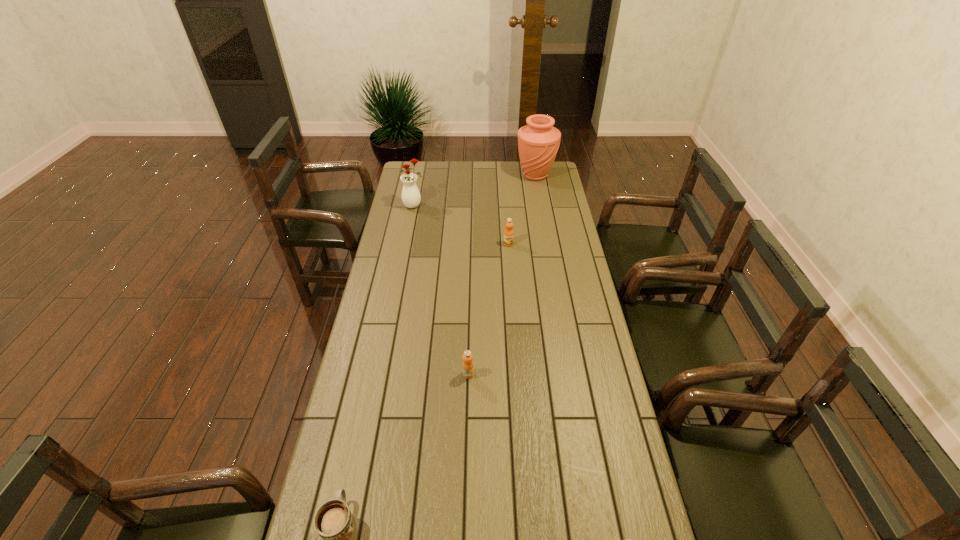
Image resolution: width=960 pixels, height=540 pixels. In order to click on free space located 0.350m on the front label of the third object from right to left in this screenshot , I will do `click(513, 305)`.

Locate an element on the screen. The width and height of the screenshot is (960, 540). free space located on the front label of the fourth farthest object is located at coordinates (468, 393).

Locate an element on the screen. This screenshot has width=960, height=540. object located in the far edge section of the desktop is located at coordinates (538, 142).

Image resolution: width=960 pixels, height=540 pixels. In order to click on object that is at the left edge in this screenshot , I will do `click(411, 197)`.

Image resolution: width=960 pixels, height=540 pixels. In order to click on object positioned at the right edge in this screenshot , I will do `click(538, 142)`.

Identify the location of object at the far right corner. Image resolution: width=960 pixels, height=540 pixels. (538, 142).

Locate an element on the screen. This screenshot has width=960, height=540. free space at the far edge is located at coordinates (523, 176).

Locate an element on the screen. The image size is (960, 540). vacant space at the left edge is located at coordinates (414, 272).

Locate an element on the screen. This screenshot has width=960, height=540. vacant region at the right edge is located at coordinates (588, 390).

Locate an element on the screen. free space between the fifth nearest object and the tallest object is located at coordinates (475, 191).